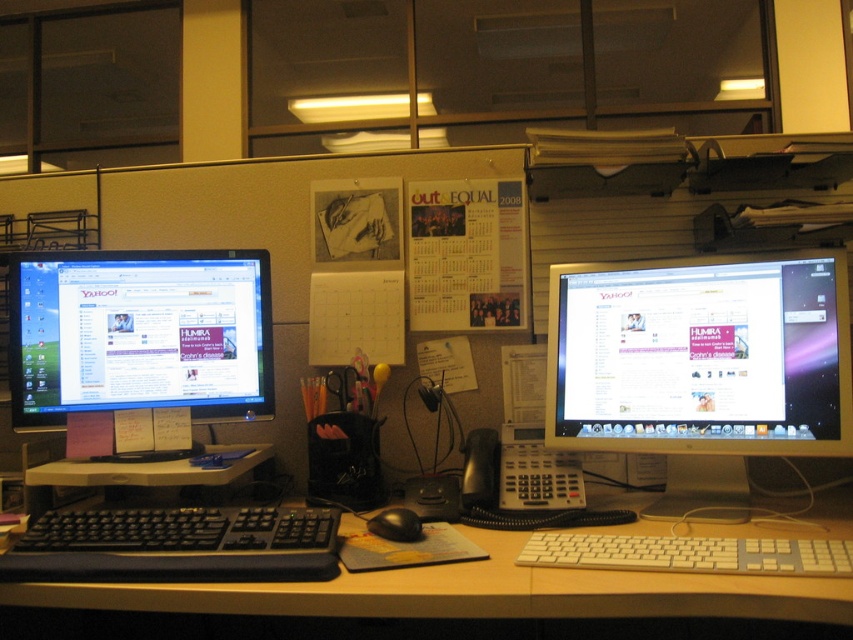
You are organizing cables on your desk and need to plug in a USB cable into the black plastic mouse at center. The cable is too short to reach beyond the matte black monitor at left. Can you plug it in without moving the mouse?

The matte black monitor at left is positioned over the black plastic mouse at center, so the mouse is underneath the monitor. Since the cable is too short to reach beyond the monitor, you cannot plug it in without moving the mouse.

You are setting up a new desk arrangement and need to place the white plastic keyboard at lower center and the black plastic keyboard at center. According to the current setup, which keyboard takes up more vertical space?

The black plastic keyboard at center is taller than the white plastic keyboard at lower center, so it takes up more vertical space.

You are setting up a new desk arrangement and want to place a large plant between the white plastic keyboard at lower center and the black plastic keyboard at center. Given that the plant requires 30 cm of space, can the available space accommodate it?

The white plastic keyboard at lower center is larger than the black plastic keyboard at center. However, the exact distance between them isn